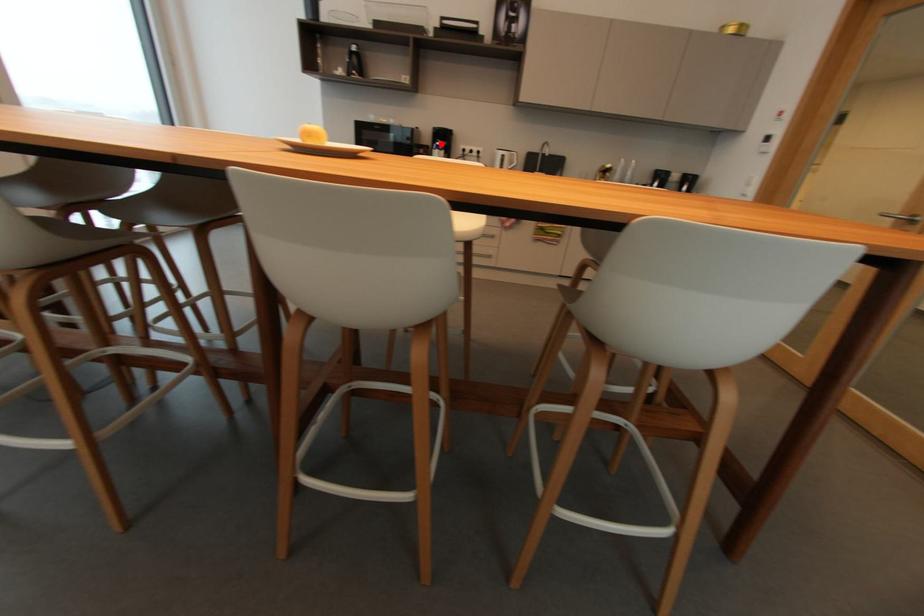
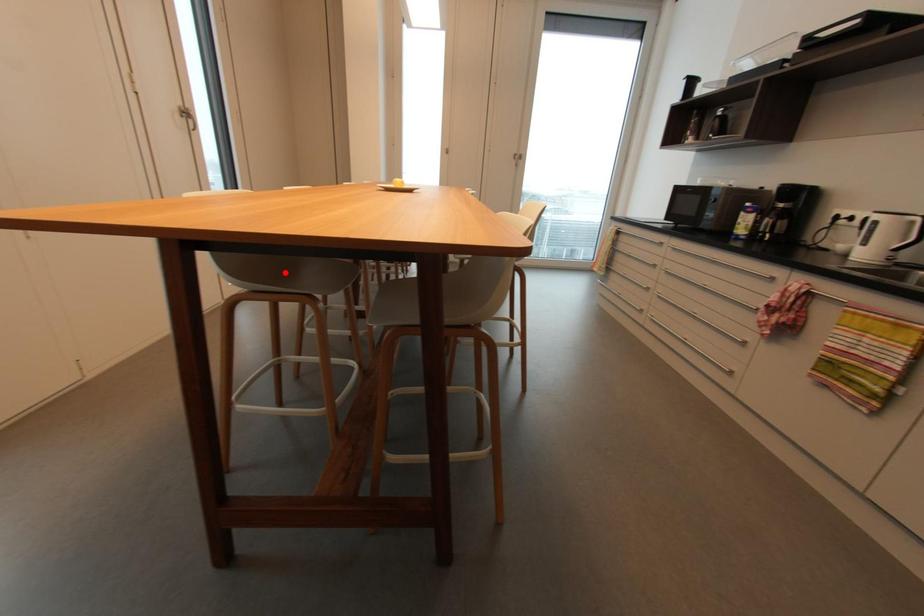
I am providing you with two images of the same scene from different viewpoints. A red point is marked on the first image and another point is marked on the second image. Do the highlighted points in image1 and image2 indicate the same real-world spot?

No